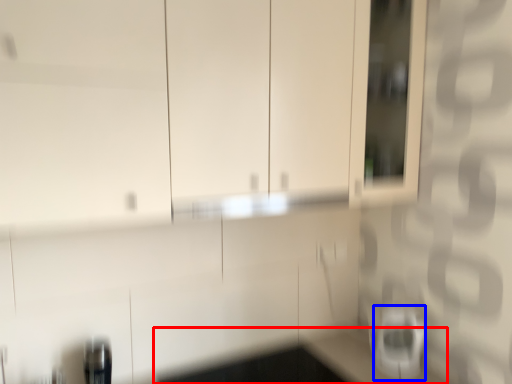
Question: Which of the following is the farthest to the observer, counter top (highlighted by a red box) or appliance (highlighted by a blue box)?

Choices:
 (A) counter top
 (B) appliance

Answer: (B)